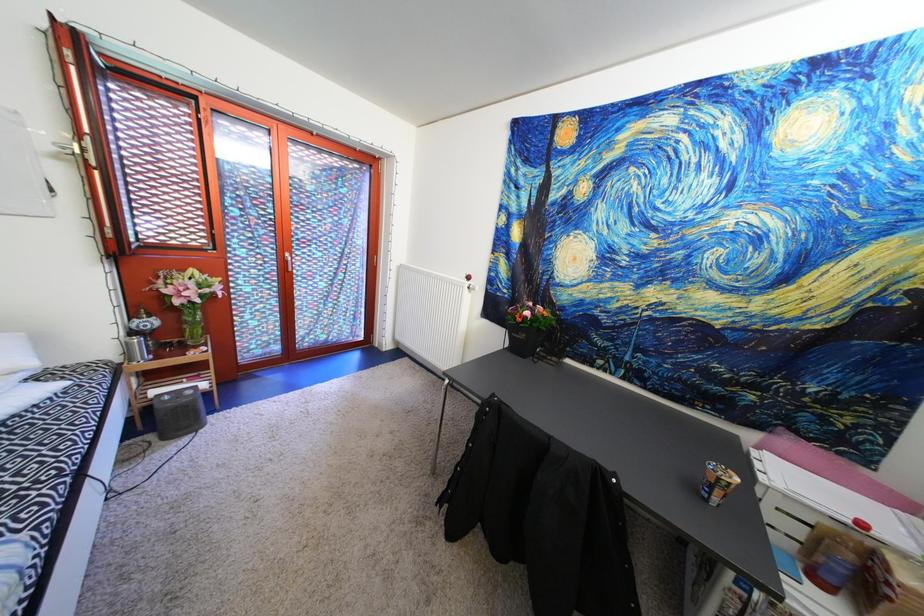
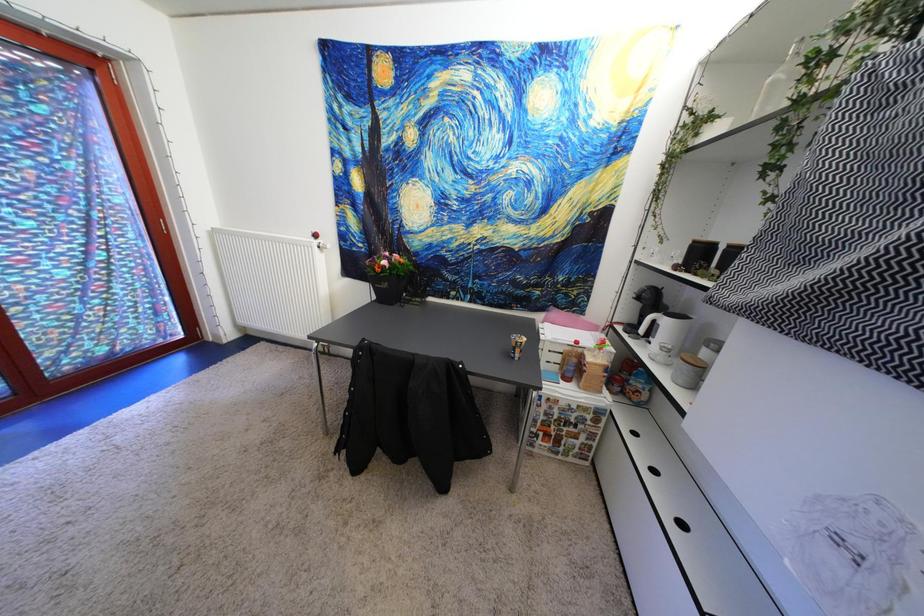
Question: The camera is either moving clockwise (left) or counter-clockwise (right) around the object. The first image is from the beginning of the video and the second image is from the end. Is the camera moving left or right when shooting the video?

Choices:
 (A) Left
 (B) Right

Answer: (A)